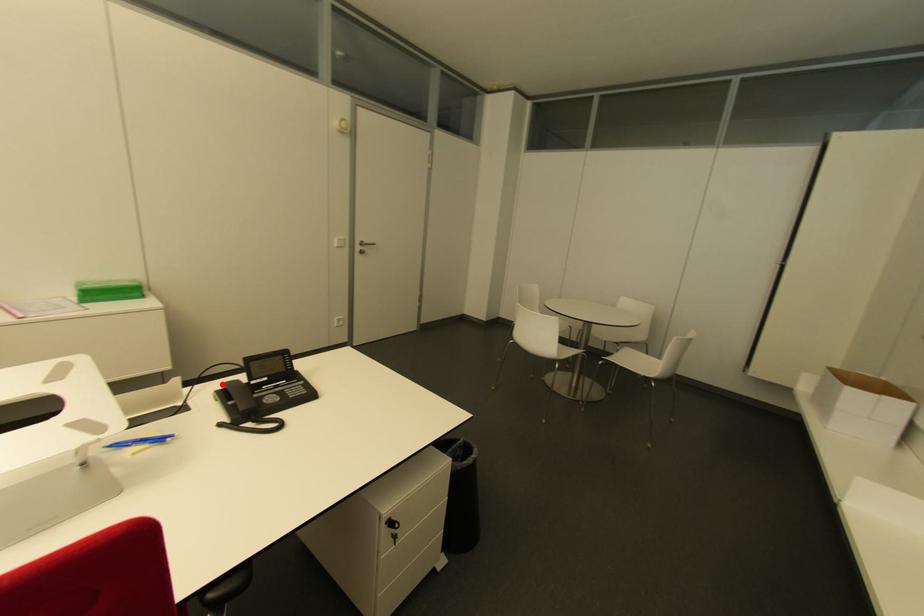
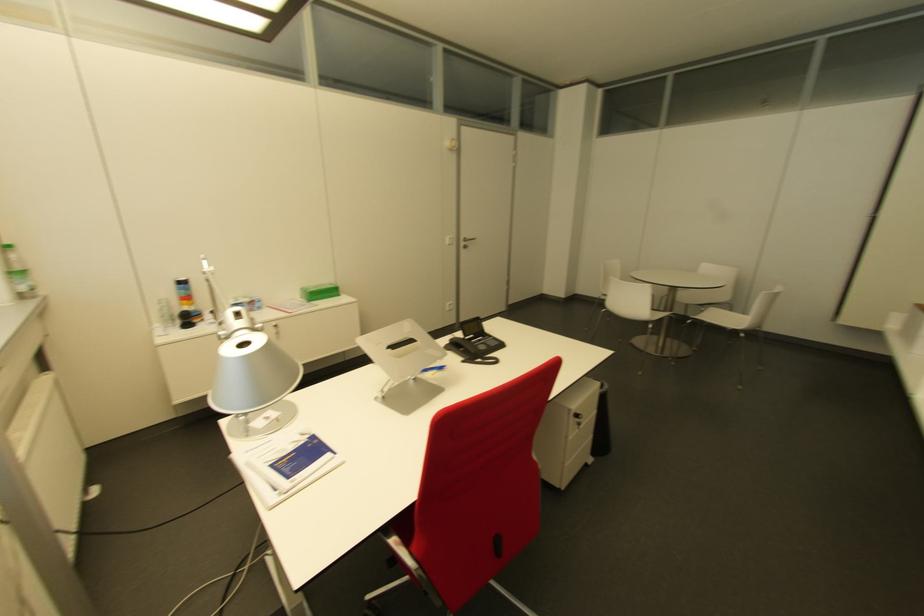
Question: I am providing you with two images of the same scene from different viewpoints. A red point is shown in image1. For the corresponding object point in image2, is it positioned nearer or farther from the camera?

Choices:
 (A) Nearer
 (B) Farther

Answer: (A)